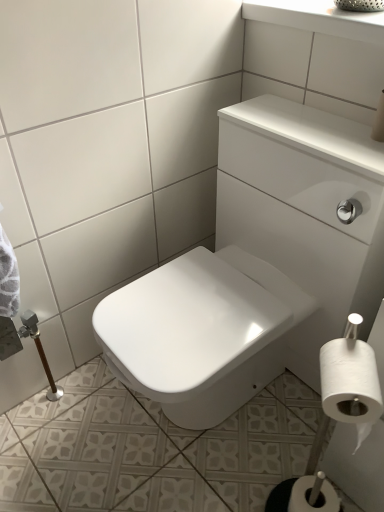
Question: Considering the positions of white matte toilet paper at lower right, which appears as the first toilet paper when ordered from the bottom, and white glossy sink at upper center in the image, is white matte toilet paper at lower right, which appears as the first toilet paper when ordered from the bottom, bigger or smaller than white glossy sink at upper center?

Choices:
 (A) big
 (B) small

Answer: (B)

Question: Is white matte toilet paper at lower right, the 1th toilet paper from the back, in front of or behind white glossy sink at upper center in the image?

Choices:
 (A) behind
 (B) front

Answer: (A)

Question: Which is nearer to the white glossy sink at upper center?

Choices:
 (A) white matte toilet paper at lower right, which appears as the first toilet paper when ordered from the bottom
 (B) white matte toilet paper at lower right, acting as the 2th toilet paper starting from the bottom

Answer: (B)

Question: Which object is positioned closest to the white matte toilet paper at lower right, which appears as the first toilet paper when ordered from the bottom?

Choices:
 (A) white matte toilet paper at lower right, which ranks as the first toilet paper in front-to-back order
 (B) white glossy sink at upper center

Answer: (A)